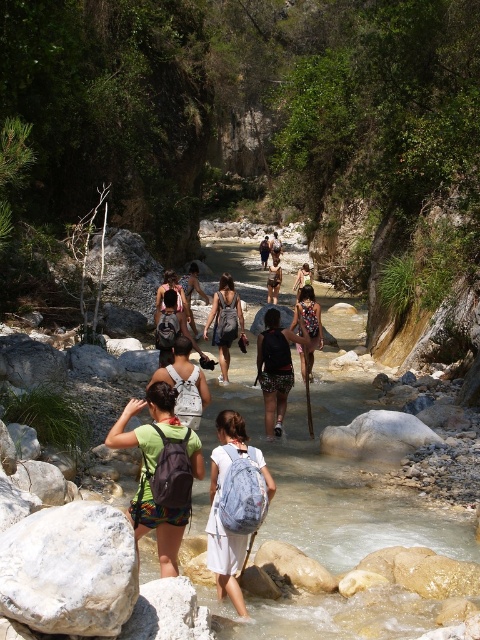
Question: Is white smooth rock at lower left above denim skirt at center?

Choices:
 (A) yes
 (B) no

Answer: (B)

Question: Does clear water stream at center have a greater width compared to denim skirt at center?

Choices:
 (A) no
 (B) yes

Answer: (B)

Question: Which object is positioned closest to the clear water stream at center?

Choices:
 (A) matte gray backpack at center
 (B) white smooth rock at lower left

Answer: (B)

Question: Which point appears closest to the camera in this image?

Choices:
 (A) (223, 358)
 (B) (2, 570)
 (C) (308, 308)

Answer: (B)

Question: Can you confirm if white smooth rock at lower left is wider than matte gray backpack at center?

Choices:
 (A) no
 (B) yes

Answer: (B)

Question: Which is farther from the denim skirt at center?

Choices:
 (A) light blue backpack at center
 (B) clear water stream at center

Answer: (A)